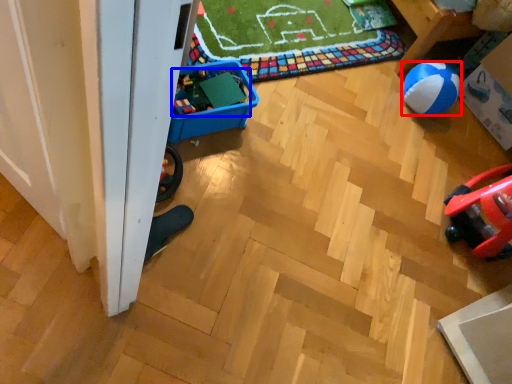
Question: Among these objects, which one is farthest to the camera, ball (highlighted by a red box) or toy (highlighted by a blue box)?

Choices:
 (A) ball
 (B) toy

Answer: (A)